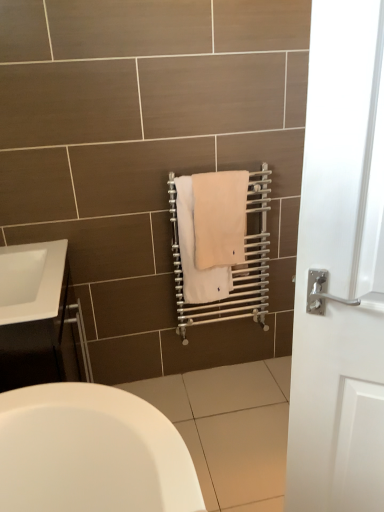
Question: Which direction should I rotate to look at beige cotton towel at center, positioned as the 1th bath towel in right-to-left order?

Choices:
 (A) right
 (B) left

Answer: (A)

Question: Is the position of silver metallic towel rack at center less distant than that of beige cotton towel at center, positioned as the 1th bath towel in right-to-left order?

Choices:
 (A) no
 (B) yes

Answer: (A)

Question: Considering the relative sizes of silver metallic towel rack at center and beige cotton towel at center, positioned as the 1th bath towel in right-to-left order, in the image provided, is silver metallic towel rack at center smaller than beige cotton towel at center, positioned as the 1th bath towel in right-to-left order,?

Choices:
 (A) no
 (B) yes

Answer: (A)

Question: From the image's perspective, is silver metallic towel rack at center beneath beige cotton towel at center, the 2th bath towel viewed from the left?

Choices:
 (A) no
 (B) yes

Answer: (B)

Question: Does silver metallic towel rack at center lie behind beige cotton towel at center, positioned as the 1th bath towel in right-to-left order?

Choices:
 (A) no
 (B) yes

Answer: (B)

Question: Is silver metallic towel rack at center turned away from beige cotton towel at center, the 2th bath towel viewed from the left?

Choices:
 (A) no
 (B) yes

Answer: (B)

Question: Considering the relative sizes of silver metallic towel rack at center and beige cotton towel at center, positioned as the 1th bath towel in right-to-left order, in the image provided, is silver metallic towel rack at center bigger than beige cotton towel at center, positioned as the 1th bath towel in right-to-left order,?

Choices:
 (A) no
 (B) yes

Answer: (B)

Question: Is silver metallic towel rack at center aimed at white glossy sink at lower left?

Choices:
 (A) no
 (B) yes

Answer: (A)

Question: From a real-world perspective, is silver metallic towel rack at center over white glossy sink at lower left?

Choices:
 (A) yes
 (B) no

Answer: (B)

Question: Is silver metallic towel rack at center in front of white glossy sink at lower left?

Choices:
 (A) yes
 (B) no

Answer: (B)

Question: Can white glossy sink at lower left be found inside silver metallic towel rack at center?

Choices:
 (A) yes
 (B) no

Answer: (B)

Question: Is silver metallic towel rack at center directly adjacent to white glossy sink at lower left?

Choices:
 (A) no
 (B) yes

Answer: (A)

Question: From the image's perspective, is silver metallic towel rack at center beneath white glossy sink at lower left?

Choices:
 (A) no
 (B) yes

Answer: (A)

Question: Can you confirm if beige cotton towel at center, the 2th bath towel viewed from the right, is shorter than white glossy cabinet at left?

Choices:
 (A) no
 (B) yes

Answer: (B)